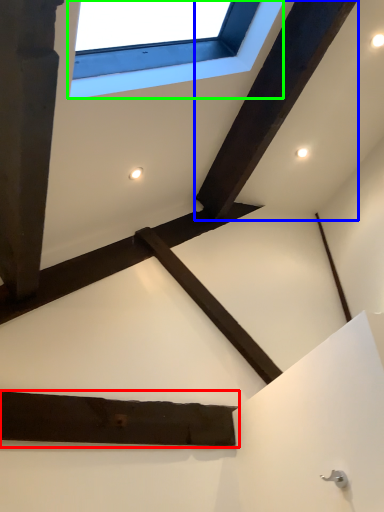
Question: Estimate the real-world distances between objects in this image. Which object is closer to plank (highlighted by a red box), plank (highlighted by a blue box) or window (highlighted by a green box)?

Choices:
 (A) plank
 (B) window

Answer: (B)